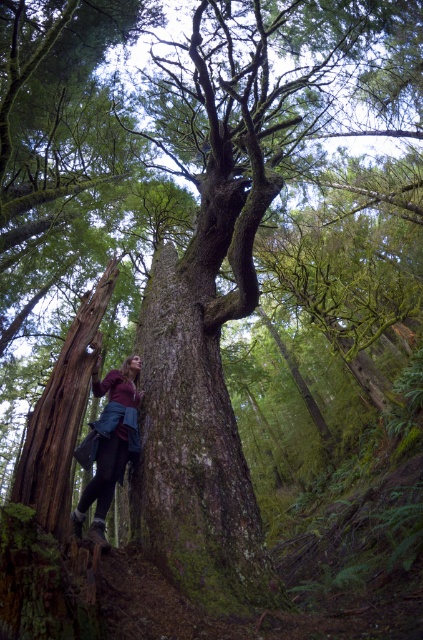
You are standing in the forest scene looking at the large mossy tree. There are two points marked on the image. Which of the two points, point (247, 604) or point (112, 371), is closer to you?

Point (247, 604) is closer to the camera than point (112, 371), so the point closer to you is point (247, 604).

You are standing in the forest and want to take a photo of the green mossy bark tree trunk at center. If you are currently at position coordinates of 0.5, 0.5, what direction should you move to get closer to the tree trunk?

The green mossy bark tree trunk at center is located at coordinates (x=195, y=444). Since your current position is (x=211, y=320), you should move northeast to reach the tree trunk.